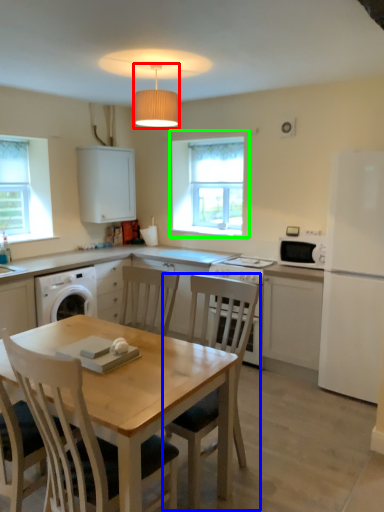
Question: Based on their relative distances, which object is nearer to lamp (highlighted by a red box)? Choose from chair (highlighted by a blue box) and window (highlighted by a green box).

Choices:
 (A) chair
 (B) window

Answer: (A)